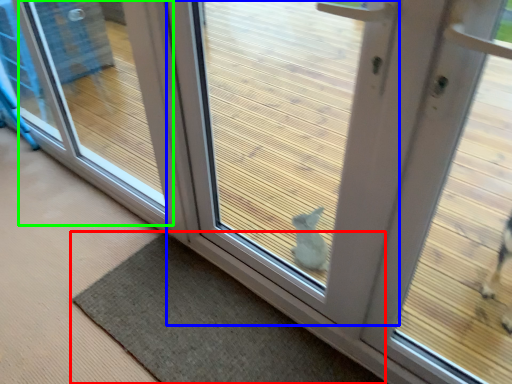
Question: Estimate the real-world distances between objects in this image. Which object is closer to mat (highlighted by a red box), door (highlighted by a blue box) or window (highlighted by a green box)?

Choices:
 (A) door
 (B) window

Answer: (A)